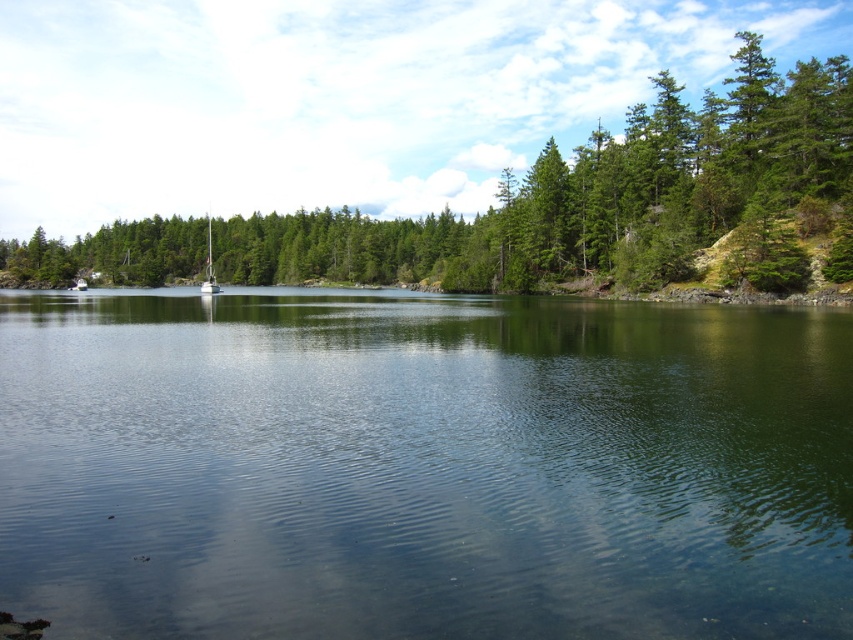
Question: Which of the following is the farthest from the observer?

Choices:
 (A) clear water at center
 (B) white glossy sailboat at center
 (C) green matte tree at center

Answer: (B)

Question: Does clear water at center have a lesser width compared to green matte tree at center?

Choices:
 (A) no
 (B) yes

Answer: (B)

Question: In this image, where is clear water at center located relative to white glossy sailboat at center?

Choices:
 (A) above
 (B) below

Answer: (B)

Question: Among these points, which one is farthest from the camera?

Choices:
 (A) (508, 538)
 (B) (206, 285)
 (C) (273, 278)

Answer: (C)

Question: Estimate the real-world distances between objects in this image. Which object is farther from the white glossy sailboat at center?

Choices:
 (A) green matte tree at center
 (B) clear water at center

Answer: (B)

Question: Is clear water at center bigger than white glossy sailboat at center?

Choices:
 (A) no
 (B) yes

Answer: (A)